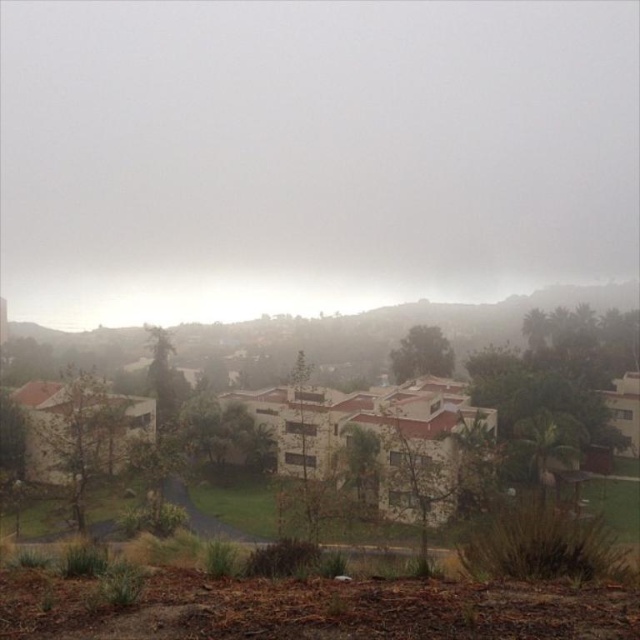
You are a photographer standing in the residential area and want to capture a shot that includes both the gray fog at upper center and the white stucco buildings at center. Based on their positions, which object should appear closer to you in the photo?

The gray fog at upper center will appear closer to you in the photo because it is further to the viewer than the white stucco buildings at center, meaning it is positioned nearer in the scene.

You are a photographer trying to capture the white stucco buildings at center in your shot. However, the gray fog at upper center is obstructing the view. Can you estimate whether the fog is large enough to completely cover the buildings in the photo?

The gray fog at upper center is bigger than the white stucco buildings at center, so yes, the fog can completely cover the buildings in the photo.

You are an aerial photographer planning to capture the residential area shown in the image. The gray fog at upper center is an important element to highlight. To ensure the fog is centered in your shot, what coordinates should you aim for?

The gray fog at upper center is located at coordinates point (310, 156), so you should aim for those coordinates to center it in your shot.